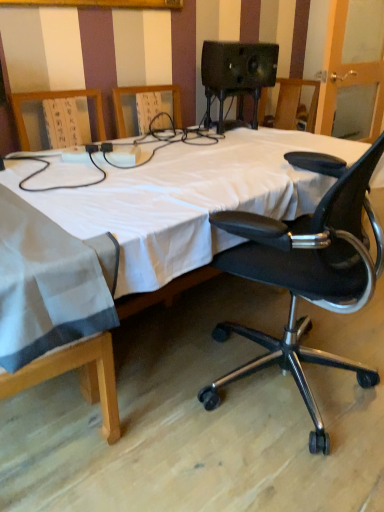
Image resolution: width=384 pixels, height=512 pixels. What do you see at coordinates (307, 270) in the screenshot? I see `white fabric bed at center` at bounding box center [307, 270].

This screenshot has width=384, height=512. Find the location of `white fabric bed at center`. white fabric bed at center is located at coordinates (307, 270).

Locate an element on the screen. black matte office chair at right is located at coordinates (306, 277).

What do you see at coordinates (306, 277) in the screenshot?
I see `black matte office chair at right` at bounding box center [306, 277].

You are a GUI agent. You are given a task and a screenshot of the screen. Output one action in this format:
    pyautogui.click(x=<x>, y=<y>)
    Task: Click on the white fabric bed at center
    The height and width of the screenshot is (512, 384).
    Given the screenshot: What is the action you would take?
    pyautogui.click(x=307, y=270)

Considering the relative positions of white fabric bed at center and black matte office chair at right in the image provided, is white fabric bed at center to the right of black matte office chair at right from the viewer's perspective?

In fact, white fabric bed at center is to the left of black matte office chair at right.

Is the depth of white fabric bed at center less than that of black matte office chair at right?

Yes, the depth of white fabric bed at center is less than that of black matte office chair at right.

Is point (252, 221) positioned behind point (378, 140)?

Yes, it is behind point (378, 140).

From the image's perspective, which is above, white fabric bed at center or black matte office chair at right?

From the image's view, white fabric bed at center is above.

From a real-world perspective, which object stands above the other?

From a 3D spatial view, black matte office chair at right is above.

Looking at their sizes, would you say white fabric bed at center is wider or thinner than black matte office chair at right?

In the image, white fabric bed at center appears to be wider than black matte office chair at right.

Which of these two, white fabric bed at center or black matte office chair at right, stands shorter?

white fabric bed at center is shorter.

Who is bigger, white fabric bed at center or black matte office chair at right?

white fabric bed at center is bigger.

Is white fabric bed at center positioned beyond the bounds of black matte office chair at right?

Yes, white fabric bed at center is outside of black matte office chair at right.

Is white fabric bed at center directly adjacent to black matte office chair at right?

Absolutely, white fabric bed at center is next to and touching black matte office chair at right.

Is black matte office chair at right at the back of white fabric bed at center?

Yes, white fabric bed at center is positioned with its back facing black matte office chair at right.

How far apart are white fabric bed at center and black matte office chair at right?

A distance of 0.95 centimeters exists between white fabric bed at center and black matte office chair at right.

The height and width of the screenshot is (512, 384). Identify the location of chair that is above the white fabric bed at center (from a real-world perspective). [306, 277].

Is black matte office chair at right at the right side of white fabric bed at center?

Yes, black matte office chair at right is to the right of white fabric bed at center.

Relative to white fabric bed at center, is black matte office chair at right in front or behind?

Visually, black matte office chair at right is located behind white fabric bed at center.

Which is farther, (310, 436) or (238, 236)?

Point (310, 436)

From the image's perspective, is black matte office chair at right below white fabric bed at center?

Correct, black matte office chair at right appears lower than white fabric bed at center in the image.

From a real-world perspective, which object rests below the other?

In real-world perspective, white fabric bed at center is lower.

Which of these two, black matte office chair at right or white fabric bed at center, is thinner?

Thinner between the two is black matte office chair at right.

Does black matte office chair at right have a lesser height compared to white fabric bed at center?

In fact, black matte office chair at right may be taller than white fabric bed at center.

Considering the sizes of black matte office chair at right and white fabric bed at center in the image, is black matte office chair at right bigger or smaller than white fabric bed at center?

black matte office chair at right is smaller than white fabric bed at center.

Is black matte office chair at right located outside white fabric bed at center?

Indeed, black matte office chair at right is completely outside white fabric bed at center.

Would you consider black matte office chair at right to be distant from white fabric bed at center?

They are positioned close to each other.

Could you tell me if black matte office chair at right is turned towards white fabric bed at center?

Yes, black matte office chair at right is oriented towards white fabric bed at center.

Can you tell me how much black matte office chair at right and white fabric bed at center differ in facing direction?

164 degrees.

The width and height of the screenshot is (384, 512). Identify the location of bed lying on the left of black matte office chair at right. coord(307,270).

Locate an element on the screen. This screenshot has height=512, width=384. chair on the right of white fabric bed at center is located at coordinates (306, 277).

This screenshot has height=512, width=384. What are the coordinates of `bed located in front of the black matte office chair at right` in the screenshot? It's located at (307, 270).